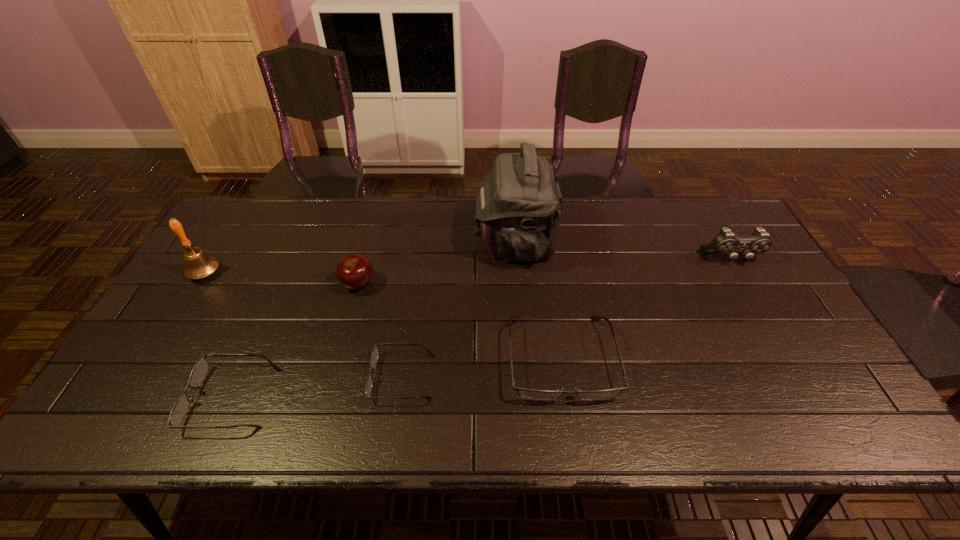
Image resolution: width=960 pixels, height=540 pixels. In order to click on the sixth shortest object in this screenshot , I will do [x=198, y=265].

The width and height of the screenshot is (960, 540). I want to click on vacant area situated 0.060m on the front-facing side of the second shortest object, so click(166, 398).

I want to click on vacant space located on the front-facing side of the second shortest object, so click(x=158, y=398).

Locate an element on the screen. This screenshot has width=960, height=540. free location located 0.190m on the front-facing side of the second shortest object is located at coordinates (110, 398).

At what (x,y) coordinates should I click in order to perform the action: click on blank area located on the front-facing side of the fourth object from left to right. Please return your answer as a coordinate pair (x, y). This screenshot has width=960, height=540. Looking at the image, I should click on (305, 377).

In order to click on vacant space situated 0.180m on the front-facing side of the fourth object from left to right in this screenshot , I will do `click(297, 377)`.

Locate an element on the screen. The height and width of the screenshot is (540, 960). free spot located 0.230m on the front-facing side of the fourth object from left to right is located at coordinates (276, 377).

In order to click on free region located 0.140m on the open flap of the tallest object in this screenshot , I will do `click(431, 242)`.

Where is `free space located 0.160m on the open flap of the tallest object`? free space located 0.160m on the open flap of the tallest object is located at coordinates (424, 242).

Where is `free space located 0.390m on the open flap of the tallest object`? This screenshot has width=960, height=540. free space located 0.390m on the open flap of the tallest object is located at coordinates (352, 242).